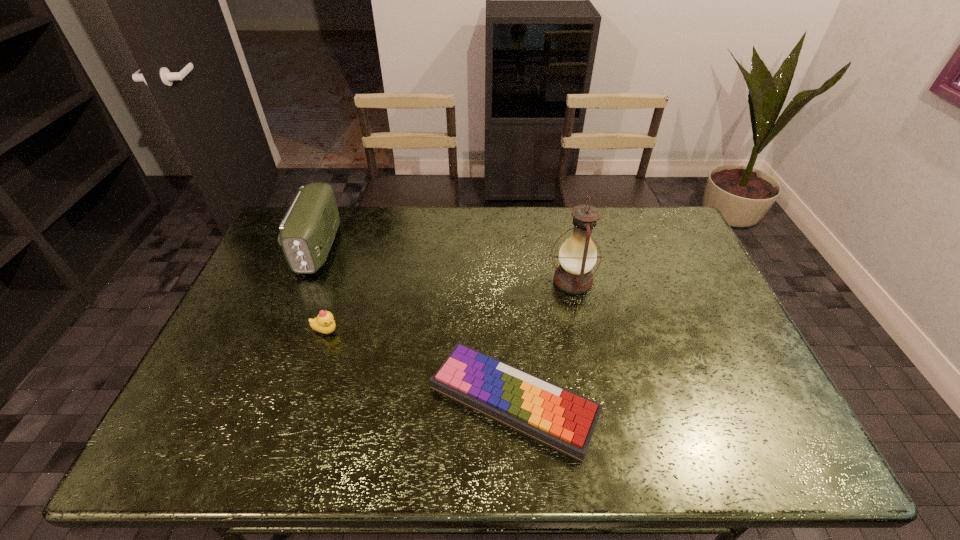
Where is `vacant space located 0.270m on the back of the computer keyboard`? The width and height of the screenshot is (960, 540). vacant space located 0.270m on the back of the computer keyboard is located at coordinates (507, 279).

Find the location of a particular element. This screenshot has height=540, width=960. object that is positioned at the far edge is located at coordinates (307, 231).

Locate an element on the screen. This screenshot has height=540, width=960. object that is at the near edge is located at coordinates (552, 415).

I want to click on object located at the left edge, so click(x=307, y=231).

Find the location of a particular element. Image resolution: width=960 pixels, height=540 pixels. object present at the far left corner is located at coordinates (307, 231).

The width and height of the screenshot is (960, 540). Find the location of `vacant space at the far edge of the desktop`. vacant space at the far edge of the desktop is located at coordinates (501, 236).

Locate an element on the screen. free space at the near edge of the desktop is located at coordinates (246, 449).

This screenshot has width=960, height=540. In order to click on vacant space at the left edge in this screenshot , I will do `click(184, 419)`.

Image resolution: width=960 pixels, height=540 pixels. Find the location of `free space at the right edge of the desktop`. free space at the right edge of the desktop is located at coordinates (665, 248).

In the image, there is a desktop. At what (x,y) coordinates should I click in order to perform the action: click on free region at the far right corner. Please return your answer as a coordinate pair (x, y). The width and height of the screenshot is (960, 540). Looking at the image, I should click on pos(664,242).